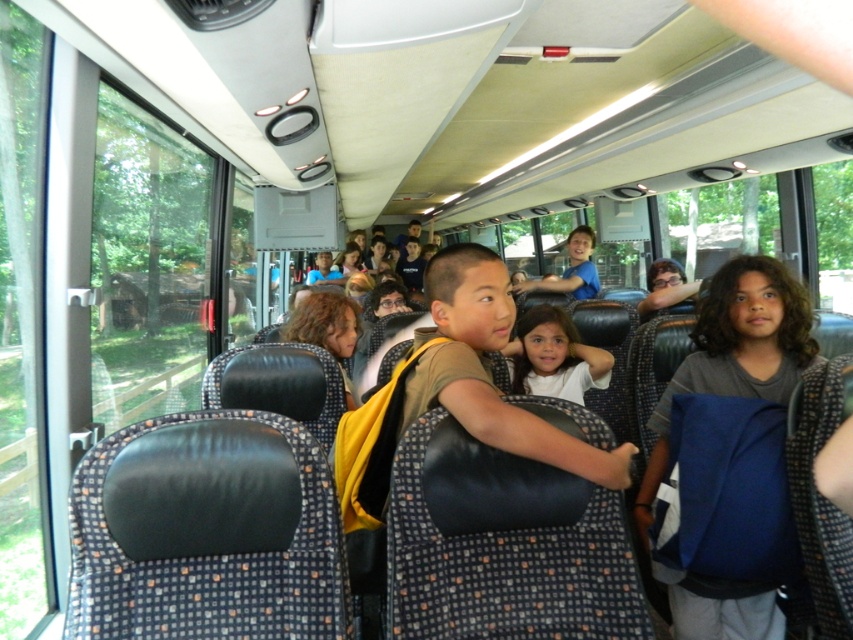
How far apart are gray cotton shirt at right and white matte shirt at center?

gray cotton shirt at right and white matte shirt at center are 35.50 inches apart from each other.

Is gray cotton shirt at right bigger than white matte shirt at center?

Yes, gray cotton shirt at right is bigger than white matte shirt at center.

This screenshot has height=640, width=853. I want to click on gray cotton shirt at right, so click(735, 353).